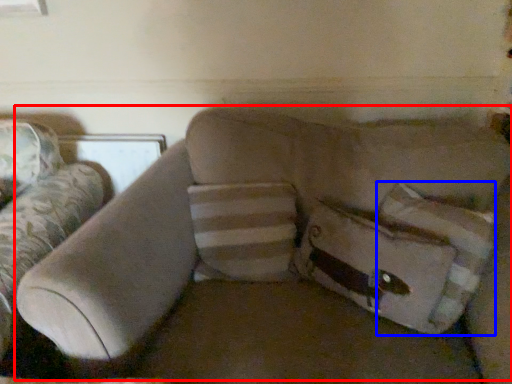
Question: Which point is closer to the camera, couch (highlighted by a red box) or pillow (highlighted by a blue box)?

Choices:
 (A) couch
 (B) pillow

Answer: (A)